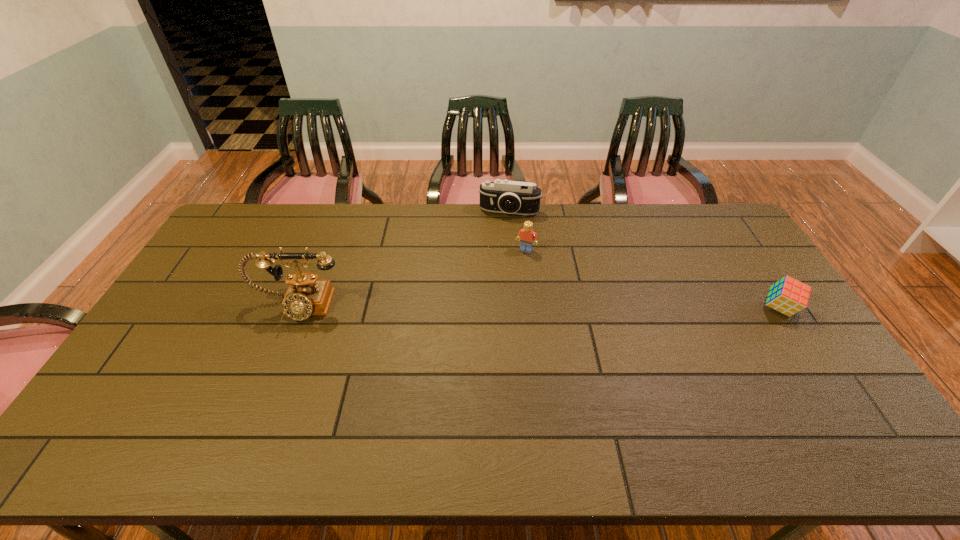
Locate an element on the screen. the leftmost object is located at coordinates (307, 295).

Find the location of a particular element. The height and width of the screenshot is (540, 960). the tallest object is located at coordinates (307, 295).

Identify the location of cube. (788, 296).

The height and width of the screenshot is (540, 960). Identify the location of the rightmost object. (788, 296).

You are a GUI agent. You are given a task and a screenshot of the screen. Output one action in this format:
    pyautogui.click(x=<x>, y=<y>)
    Task: Click on the third nearest object
    This screenshot has height=540, width=960.
    Given the screenshot: What is the action you would take?
    pyautogui.click(x=526, y=235)

What are the coordinates of `the farthest object` in the screenshot? It's located at (501, 196).

This screenshot has width=960, height=540. In order to click on vacant space located on the dial number of the telephone in this screenshot , I will do `click(258, 403)`.

Locate an element on the screen. This screenshot has height=540, width=960. free space located on the back of the rightmost object is located at coordinates (736, 242).

Where is `free space located on the front-facing side of the second farthest object`? This screenshot has width=960, height=540. free space located on the front-facing side of the second farthest object is located at coordinates (516, 266).

Where is `free space located 0.100m on the front-facing side of the second farthest object`? The image size is (960, 540). free space located 0.100m on the front-facing side of the second farthest object is located at coordinates (514, 272).